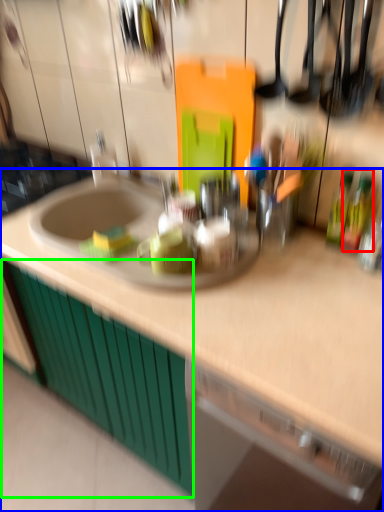
Question: Which object is positioned farthest from bottle (highlighted by a red box)? Select from countertop (highlighted by a blue box) and cabinetry (highlighted by a green box).

Choices:
 (A) countertop
 (B) cabinetry

Answer: (B)